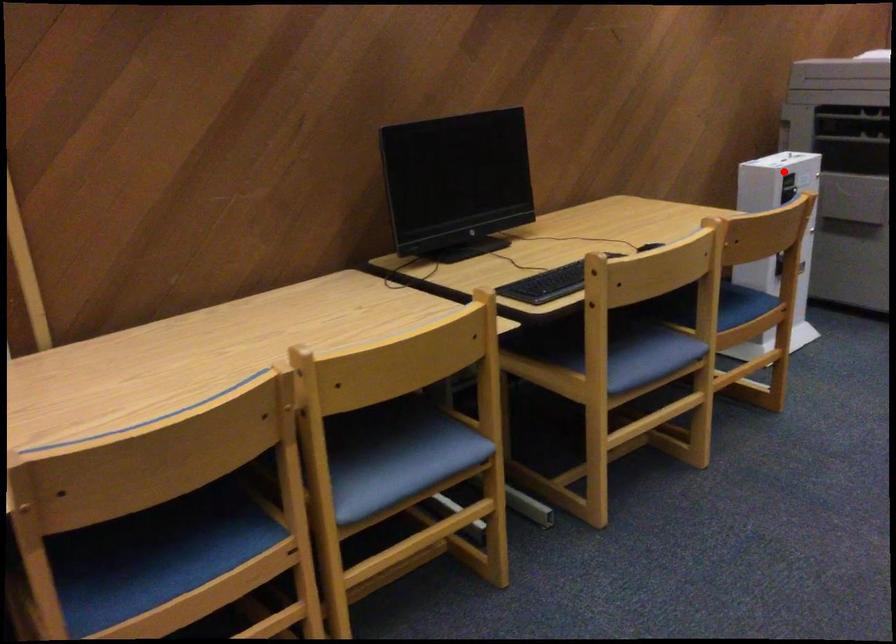
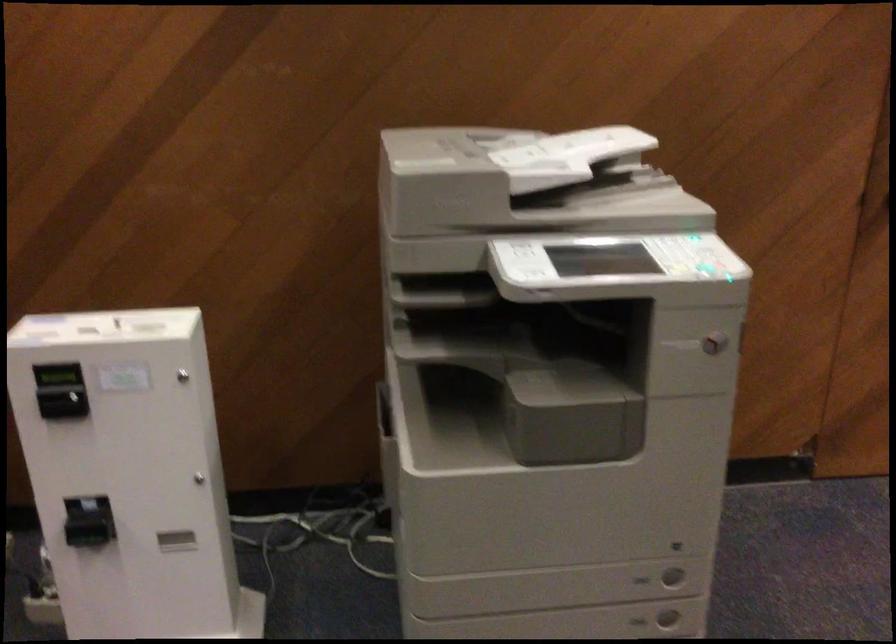
Where in the second image is the point corresponding to the highlighted location from the first image?

(56, 375)